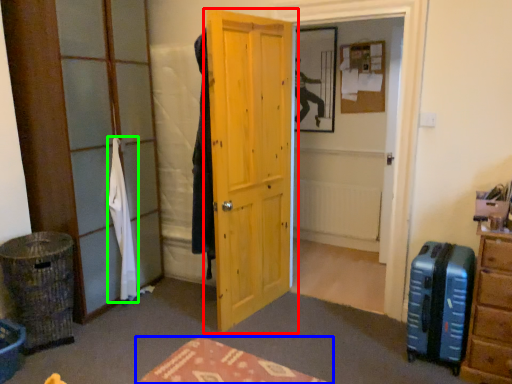
Question: Estimate the real-world distances between objects in this image. Which object is farther from door (highlighted by a red box), furniture (highlighted by a blue box) or clothing (highlighted by a green box)?

Choices:
 (A) furniture
 (B) clothing

Answer: (A)